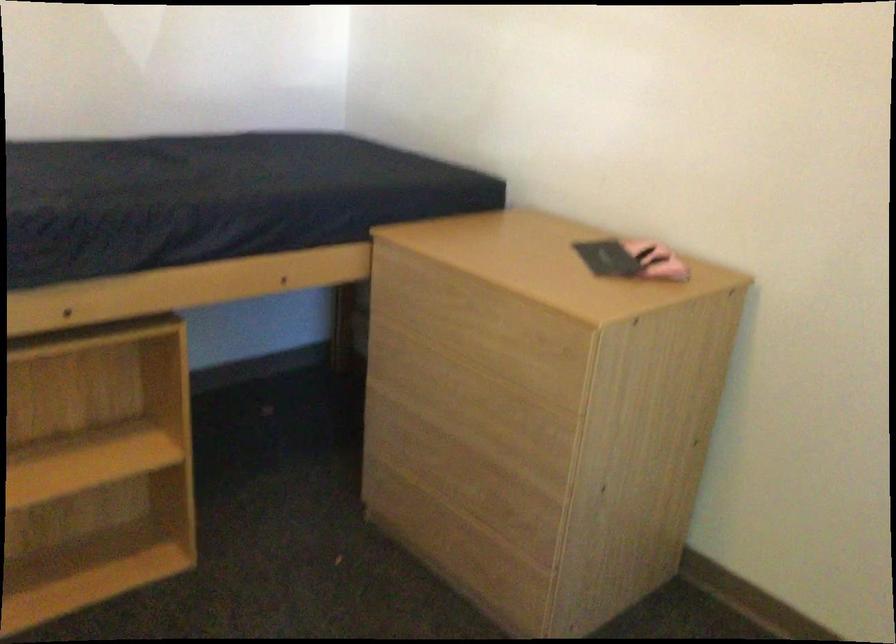
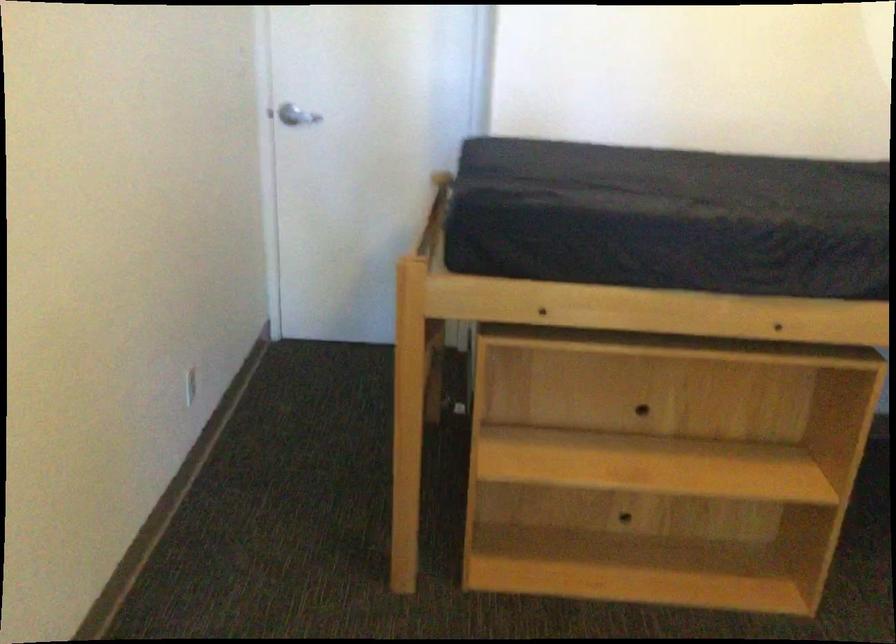
Question: How did the camera likely rotate?

Choices:
 (A) Left
 (B) Right
 (C) Up
 (D) Down

Answer: (A)